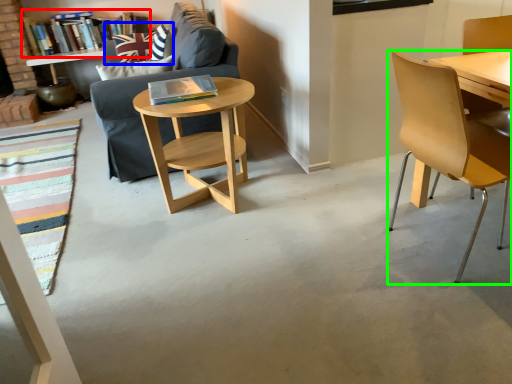
Question: Based on their relative distances, which object is farther from book (highlighted by a red box)? Choose from pillow (highlighted by a blue box) and chair (highlighted by a green box).

Choices:
 (A) pillow
 (B) chair

Answer: (B)